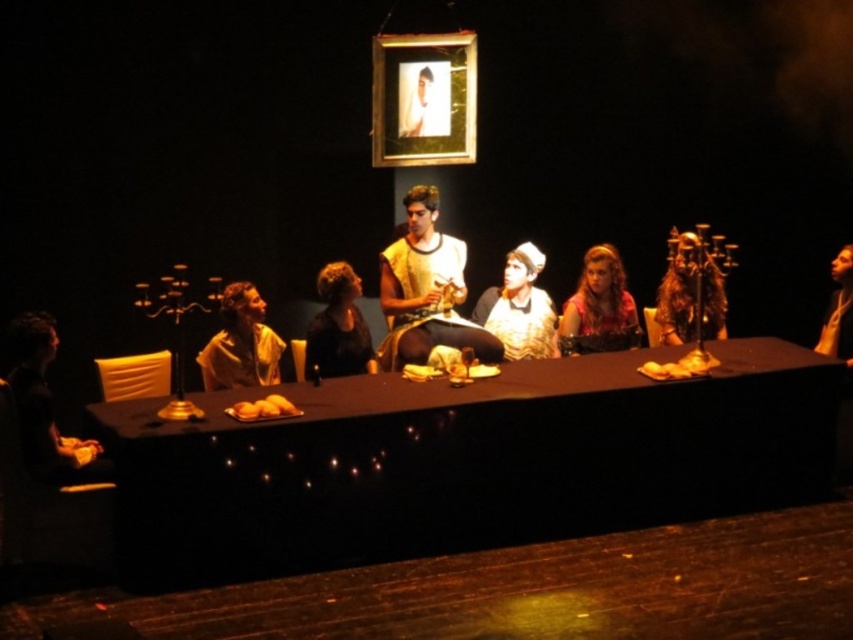
Question: Which point appears farthest from the camera in this image?

Choices:
 (A) (607, 259)
 (B) (527, 324)
 (C) (166, 568)
 (D) (666, 300)

Answer: (D)

Question: Considering the real-world distances, which object is farthest from the matte yellow shirt at center?

Choices:
 (A) black matte table at center
 (B) gold textured fabric at center
 (C) gold-framed photo at upper center
 (D) matte pink blouse at center

Answer: (D)

Question: In this image, where is dark matte shirt at center located relative to yellow matte bread at center?

Choices:
 (A) right
 (B) left

Answer: (A)

Question: Which of the following is the farthest from the observer?

Choices:
 (A) (569, 333)
 (B) (666, 308)
 (C) (276, 378)

Answer: (B)

Question: Observing the image, what is the correct spatial positioning of gold fabric robe at center in reference to matte pink blouse at center?

Choices:
 (A) below
 (B) above

Answer: (B)

Question: Is gold fabric robe at center positioned in front of gold textured fabric at center?

Choices:
 (A) yes
 (B) no

Answer: (A)